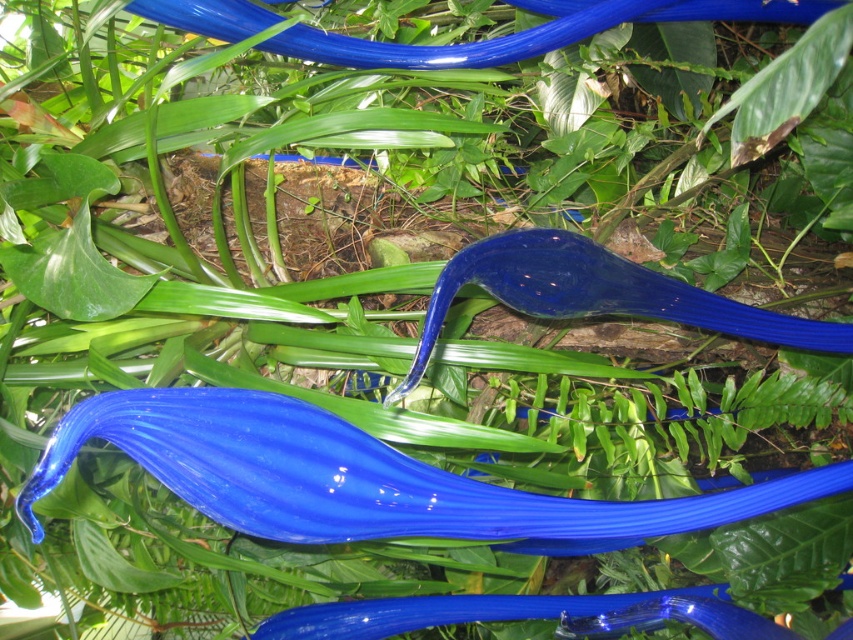
Question: Which object is farther from the camera taking this photo?

Choices:
 (A) glossy blue hose at upper center
 (B) glossy blue hose at center

Answer: (A)

Question: Can you confirm if glossy glass hose at center is wider than glossy blue hose at upper center?

Choices:
 (A) yes
 (B) no

Answer: (B)

Question: Which object is the closest to the glossy blue hose at center?

Choices:
 (A) glossy glass hose at center
 (B) glossy blue hose at upper center

Answer: (A)

Question: Considering the relative positions of glossy glass hose at center and glossy blue hose at upper center in the image provided, where is glossy glass hose at center located with respect to glossy blue hose at upper center?

Choices:
 (A) above
 (B) below

Answer: (B)

Question: Which point is closer to the camera taking this photo?

Choices:
 (A) (163, 17)
 (B) (621, 266)

Answer: (B)

Question: Does glossy blue hose at center appear on the right side of glossy glass hose at center?

Choices:
 (A) no
 (B) yes

Answer: (A)